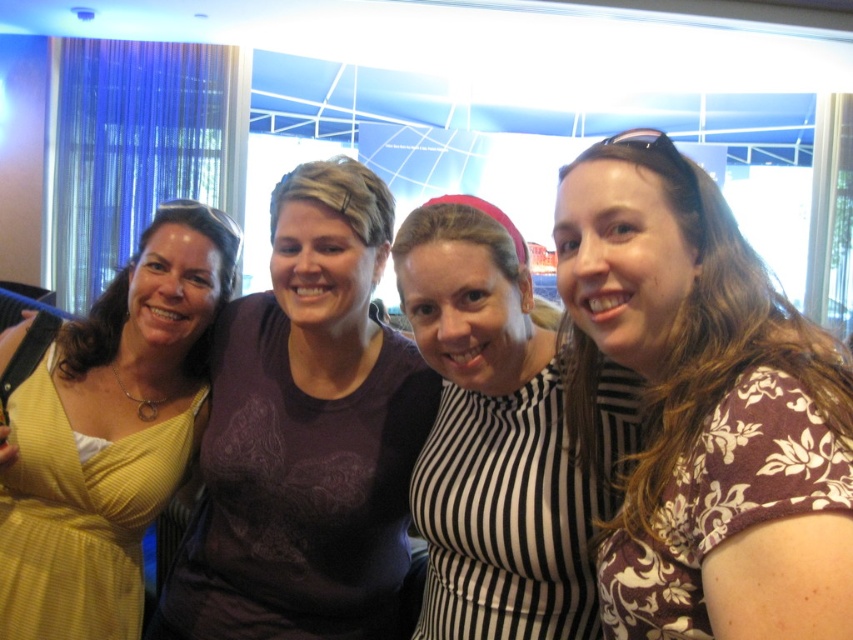
Does floral print shirt at right have a greater height compared to black and white striped shirt at center?

Indeed, floral print shirt at right has a greater height compared to black and white striped shirt at center.

Can you confirm if floral print shirt at right is bigger than black and white striped shirt at center?

Yes, floral print shirt at right is bigger than black and white striped shirt at center.

Locate an element on the screen. floral print shirt at right is located at coordinates (704, 406).

Can you confirm if floral print shirt at right is positioned below matte yellow dress at left?

Incorrect, floral print shirt at right is not positioned below matte yellow dress at left.

Is floral print shirt at right wider than matte yellow dress at left?

In fact, floral print shirt at right might be narrower than matte yellow dress at left.

Is point (682, 179) closer to viewer compared to point (114, 403)?

Yes, point (682, 179) is closer to viewer.

In order to click on floral print shirt at right in this screenshot , I will do `click(704, 406)`.

Locate an element on the screen. matte purple shirt at center is located at coordinates (306, 435).

Between matte purple shirt at center and matte yellow dress at left, which one has less height?

matte yellow dress at left is shorter.

Which is in front, point (289, 426) or point (125, 600)?

Point (289, 426) is more forward.

Where is `matte purple shirt at center`? matte purple shirt at center is located at coordinates (306, 435).